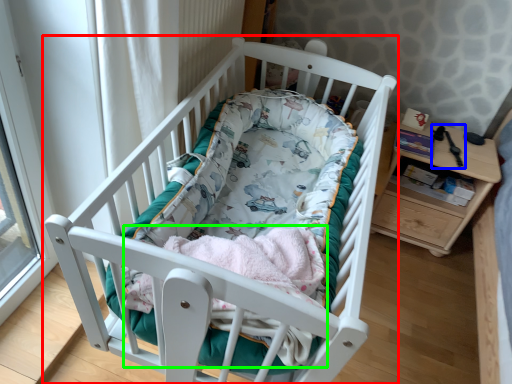
Question: Estimate the real-world distances between objects in this image. Which object is closer to infant bed (highlighted by a red box), equipment (highlighted by a blue box) or baby clothe (highlighted by a green box)?

Choices:
 (A) equipment
 (B) baby clothe

Answer: (B)